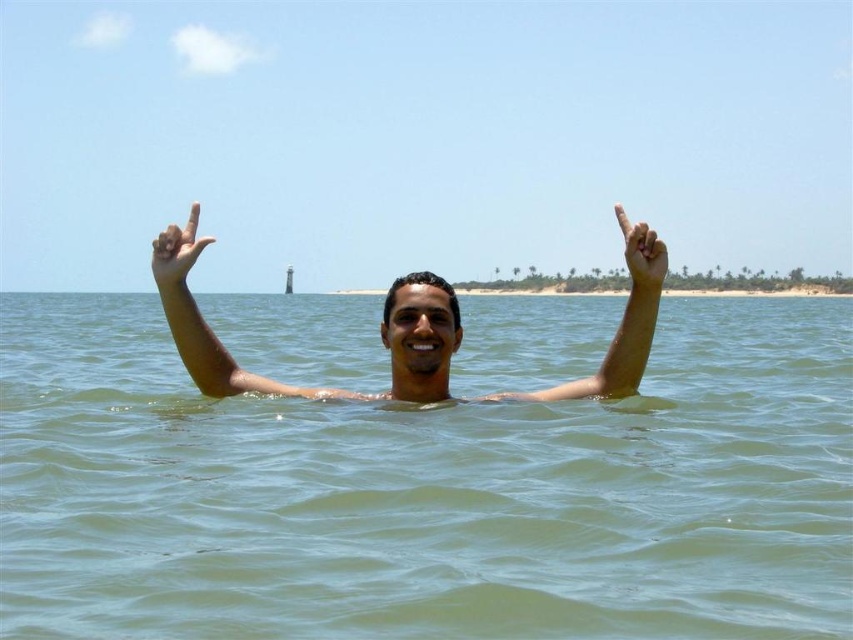
Question: Which object is positioned closest to the matte skin hand at upper center?

Choices:
 (A) greenish water at upper center
 (B) skinny tan arm at upper center
 (C) matte skin hand at upper right
 (D) smooth skin man at center

Answer: (D)

Question: Estimate the real-world distances between objects in this image. Which object is closer to the smooth skin man at center?

Choices:
 (A) matte skin hand at upper center
 (B) skinny tan arm at upper center

Answer: (A)

Question: Does smooth skin man at center have a lesser width compared to matte skin hand at upper right?

Choices:
 (A) no
 (B) yes

Answer: (B)

Question: Which point appears closest to the camera in this image?

Choices:
 (A) (642, 257)
 (B) (218, 544)
 (C) (577, 380)

Answer: (B)

Question: Can you confirm if matte skin hand at upper center is positioned to the left of matte skin hand at upper right?

Choices:
 (A) yes
 (B) no

Answer: (A)

Question: Does greenish water at upper center appear on the right side of matte skin hand at upper right?

Choices:
 (A) yes
 (B) no

Answer: (B)